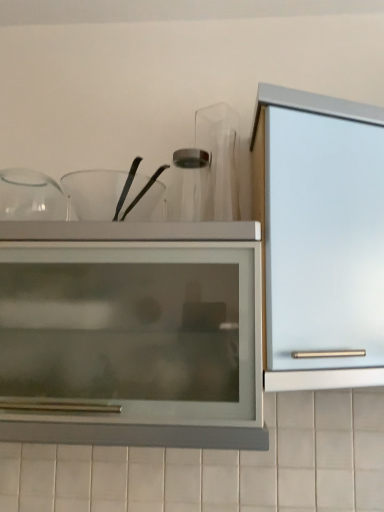
Measure the distance between matte glass cupboard at center and camera.

36.27 inches.

What do you see at coordinates (320, 238) in the screenshot?
I see `satin silver cabinet at right` at bounding box center [320, 238].

Locate an element on the screen. The image size is (384, 512). matte glass cupboard at center is located at coordinates (132, 334).

How different are the orientations of transparent glass bowls at upper center and matte glass cupboard at center in degrees?

The angle between the facing direction of transparent glass bowls at upper center and the facing direction of matte glass cupboard at center is 0.122 degrees.

From a real-world perspective, who is located lower, transparent glass bowls at upper center or matte glass cupboard at center?

In real-world perspective, matte glass cupboard at center is lower.

Which is more to the right, transparent glass bowls at upper center or matte glass cupboard at center?

matte glass cupboard at center is more to the right.

Does transparent glass bowls at upper center have a smaller size compared to matte glass cupboard at center?

Indeed, transparent glass bowls at upper center has a smaller size compared to matte glass cupboard at center.

Considering the sizes of satin silver cabinet at right and matte glass cupboard at center in the image, is satin silver cabinet at right wider or thinner than matte glass cupboard at center?

In the image, satin silver cabinet at right appears to be more narrow than matte glass cupboard at center.

Considering the points (381, 150) and (128, 390), which point is behind, point (381, 150) or point (128, 390)?

The point (381, 150) is farther.

Considering their positions, is satin silver cabinet at right located in front of or behind matte glass cupboard at center?

Clearly, satin silver cabinet at right is behind matte glass cupboard at center.

From a real-world perspective, who is located lower, satin silver cabinet at right or matte glass cupboard at center?

In real-world perspective, matte glass cupboard at center is lower.

From the image's perspective, is transparent glass bowls at upper center located above or below satin silver cabinet at right?

transparent glass bowls at upper center is above satin silver cabinet at right.

Is transparent glass bowls at upper center positioned with its back to satin silver cabinet at right?

No, transparent glass bowls at upper center's orientation is not away from satin silver cabinet at right.

Is transparent glass bowls at upper center to the left of satin silver cabinet at right from the viewer's perspective?

Yes, transparent glass bowls at upper center is to the left of satin silver cabinet at right.

Between transparent glass bowls at upper center and satin silver cabinet at right, which one has larger width?

satin silver cabinet at right.

Can you confirm if satin silver cabinet at right is positioned to the right of transparent glass bowls at upper center?

Correct, you'll find satin silver cabinet at right to the right of transparent glass bowls at upper center.

Does satin silver cabinet at right have a lesser height compared to transparent glass bowls at upper center?

No, satin silver cabinet at right is not shorter than transparent glass bowls at upper center.

Can we say satin silver cabinet at right lies outside transparent glass bowls at upper center?

Yes, satin silver cabinet at right is not within transparent glass bowls at upper center.

Is matte glass cupboard at center aimed at transparent glass bowls at upper center?

No.

Is the position of matte glass cupboard at center less distant than that of transparent glass bowls at upper center?

That is True.

Consider the image. Is matte glass cupboard at center not within transparent glass bowls at upper center?

Yes.

Which point is more distant from viewer, (123, 248) or (88, 210)?

A: The point (88, 210) is farther from the camera.

Is matte glass cupboard at center situated inside satin silver cabinet at right or outside?

matte glass cupboard at center is located beyond the bounds of satin silver cabinet at right.

Is matte glass cupboard at center positioned far away from satin silver cabinet at right?

Actually, matte glass cupboard at center and satin silver cabinet at right are a little close together.

Is matte glass cupboard at center looking in the opposite direction of satin silver cabinet at right?

No.

Locate an element on the screen. Image resolution: width=384 pixels, height=512 pixels. cupboard on the right side of transparent glass bowls at upper center is located at coordinates (132, 334).

You are a GUI agent. You are given a task and a screenshot of the screen. Output one action in this format:
    pyautogui.click(x=<x>, y=<y>)
    Task: Click on the cupboard on the left of satin silver cabinet at right
    This screenshot has width=384, height=512.
    Given the screenshot: What is the action you would take?
    pyautogui.click(x=132, y=334)

Looking at the image, which one is located closer to transparent glass bowls at upper center, matte glass cupboard at center or satin silver cabinet at right?

Among the two, matte glass cupboard at center is located nearer to transparent glass bowls at upper center.

Which object lies nearer to the anchor point matte glass cupboard at center, transparent glass bowls at upper center or satin silver cabinet at right?

satin silver cabinet at right lies closer to matte glass cupboard at center than the other object.

Which object lies further to the anchor point matte glass cupboard at center, satin silver cabinet at right or transparent glass bowls at upper center?

Based on the image, transparent glass bowls at upper center appears to be further to matte glass cupboard at center.

Looking at the image, which one is located further to satin silver cabinet at right, matte glass cupboard at center or transparent glass bowls at upper center?

transparent glass bowls at upper center is positioned further to the anchor satin silver cabinet at right.

When comparing their distances from satin silver cabinet at right, does transparent glass bowls at upper center or matte glass cupboard at center seem closer?

Among the two, matte glass cupboard at center is located nearer to satin silver cabinet at right.

Estimate the real-world distances between objects in this image. Which object is closer to transparent glass bowls at upper center, satin silver cabinet at right or matte glass cupboard at center?

Among the two, matte glass cupboard at center is located nearer to transparent glass bowls at upper center.

This screenshot has width=384, height=512. What are the coordinates of `cupboard between transparent glass bowls at upper center and satin silver cabinet at right from left to right` in the screenshot? It's located at (132, 334).